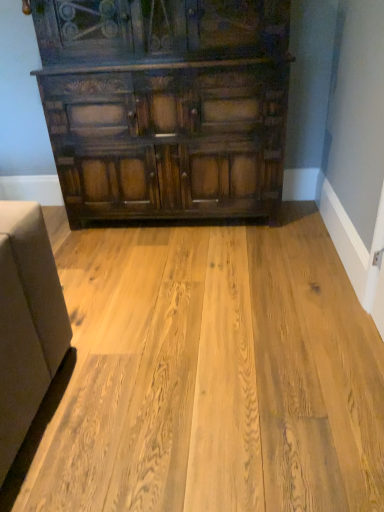
What are the coordinates of `free space in front of dark wood cabinet at upper center` in the screenshot? It's located at (191, 287).